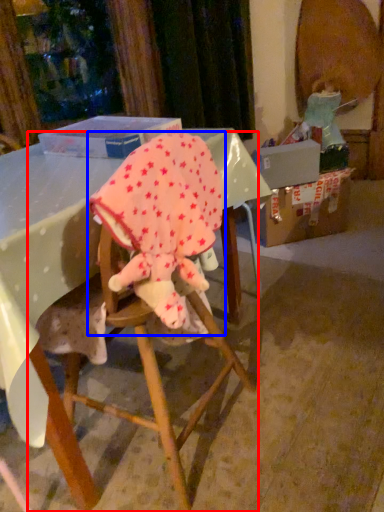
Question: Which of the following is the farthest to the observer, chair (highlighted by a red box) or baby elephant (highlighted by a blue box)?

Choices:
 (A) chair
 (B) baby elephant

Answer: (A)